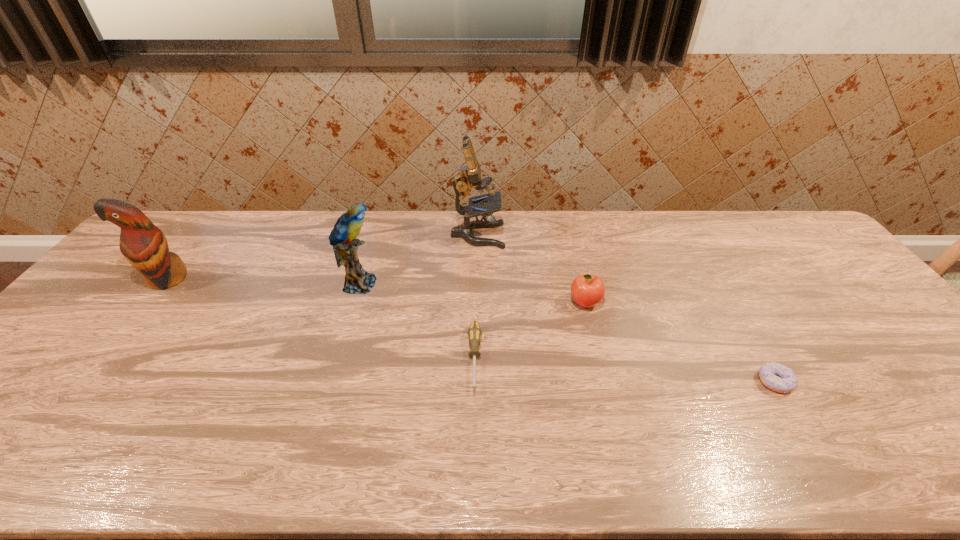
You are a GUI agent. You are given a task and a screenshot of the screen. Output one action in this format:
    pyautogui.click(x=<x>, y=<y>)
    Task: Click on the unoccupied position between the third shortest object and the microscope
    
    Given the screenshot: What is the action you would take?
    pyautogui.click(x=531, y=269)

Where is `object that is the fourth closest to the screwdriver`? The width and height of the screenshot is (960, 540). object that is the fourth closest to the screwdriver is located at coordinates (775, 376).

In order to click on object that can be found as the fifth closest to the fourth tallest object in this screenshot , I will do `click(144, 245)`.

Identify the location of vacant space that satisfies the following two spatial constraints: 1. on the face of the second object from left to right; 2. on the back side of the third shortest object. The width and height of the screenshot is (960, 540). (353, 302).

At what (x,y) coordinates should I click in order to perform the action: click on vacant space that satisfies the following two spatial constraints: 1. at the eyepieces of the farthest object; 2. on the face of the left parrot. Please return your answer as a coordinate pair (x, y). Looking at the image, I should click on (477, 279).

Find the location of a particular element. free space that satisfies the following two spatial constraints: 1. on the face of the right parrot; 2. on the right side of the third shortest object is located at coordinates (353, 302).